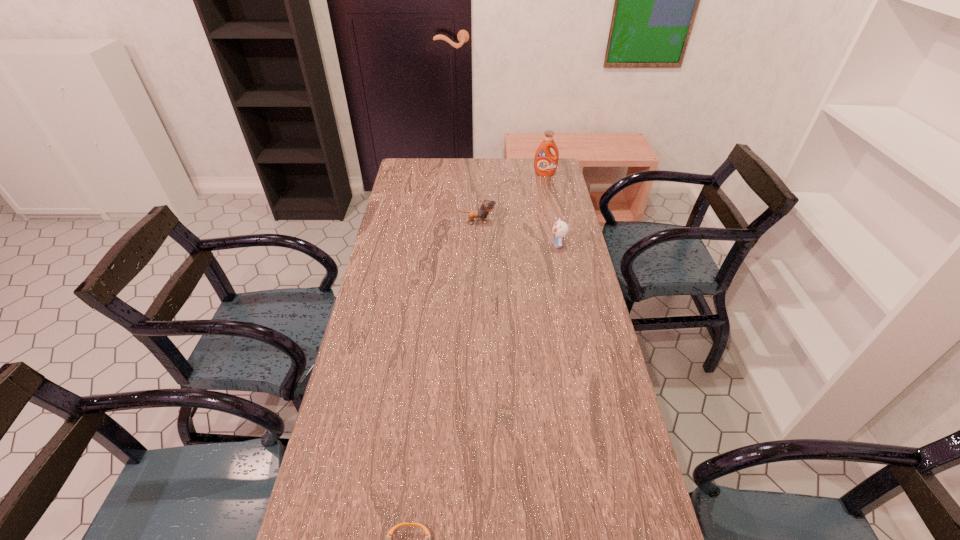
Find the location of a particular element. Image resolution: width=960 pixels, height=540 pixels. free space located 0.120m on the front-facing side of the second farthest object is located at coordinates (524, 222).

The width and height of the screenshot is (960, 540). Find the location of `object that is at the far edge`. object that is at the far edge is located at coordinates (545, 163).

The image size is (960, 540). In order to click on detergent that is at the right edge in this screenshot , I will do `click(545, 163)`.

Where is `kitten situated at the right edge`? This screenshot has height=540, width=960. kitten situated at the right edge is located at coordinates (560, 229).

The image size is (960, 540). I want to click on object situated at the far right corner, so click(545, 163).

In the image, there is a desktop. Identify the location of free space at the far edge. The image size is (960, 540). (516, 165).

In the image, there is a desktop. Where is `vacant space at the left edge`? vacant space at the left edge is located at coordinates (367, 428).

Locate an element on the screen. free space at the right edge of the desktop is located at coordinates (588, 421).

Where is `vacant point located between the left kitten and the right kitten`? vacant point located between the left kitten and the right kitten is located at coordinates (517, 233).

Where is `free spot between the tallest object and the nearer kitten`? The image size is (960, 540). free spot between the tallest object and the nearer kitten is located at coordinates (551, 210).